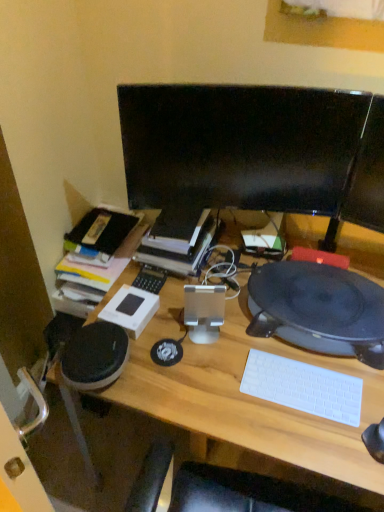
Identify the location of vacant region in front of black matte record player at right. The image size is (384, 512). (304, 413).